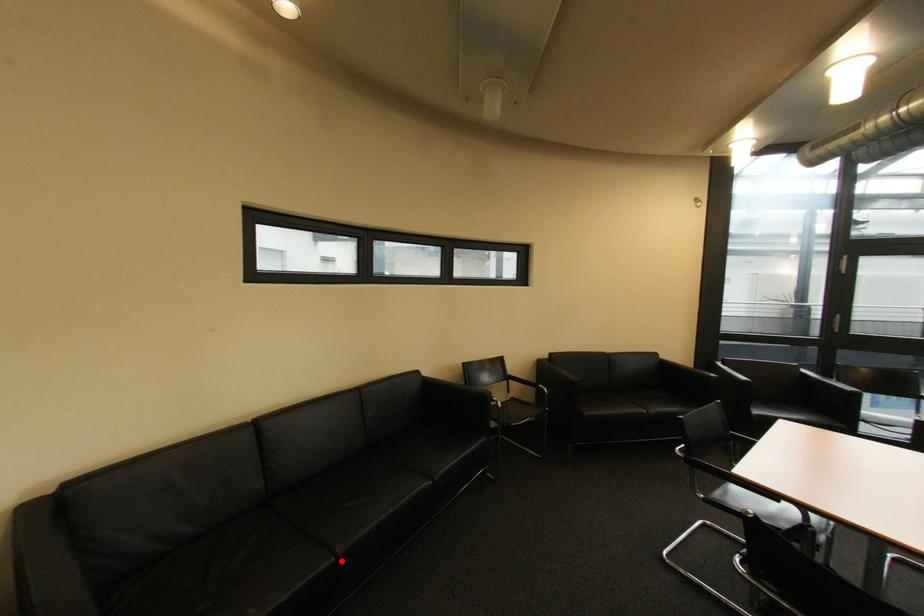
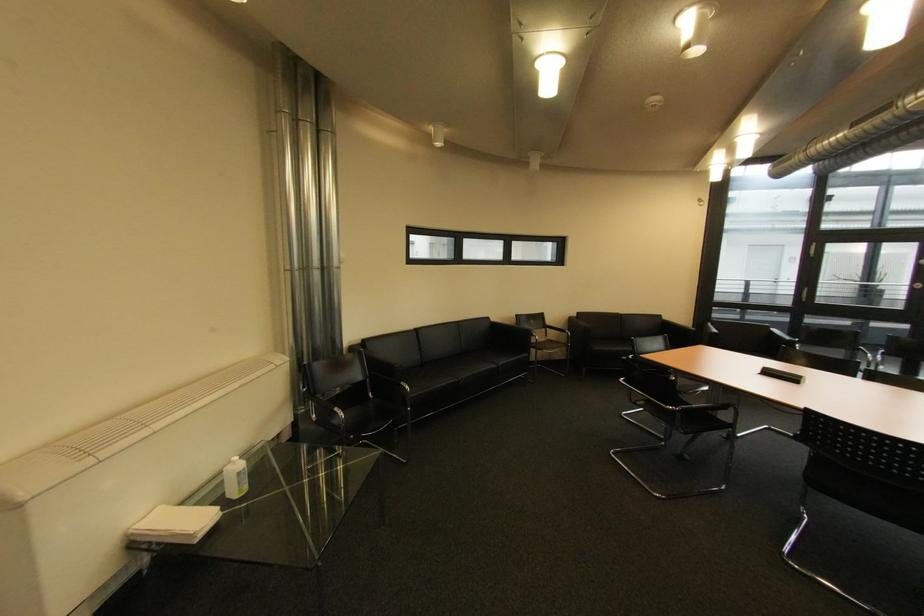
Find the pixel in the second image that matches the highlighted location in the first image.

(465, 382)